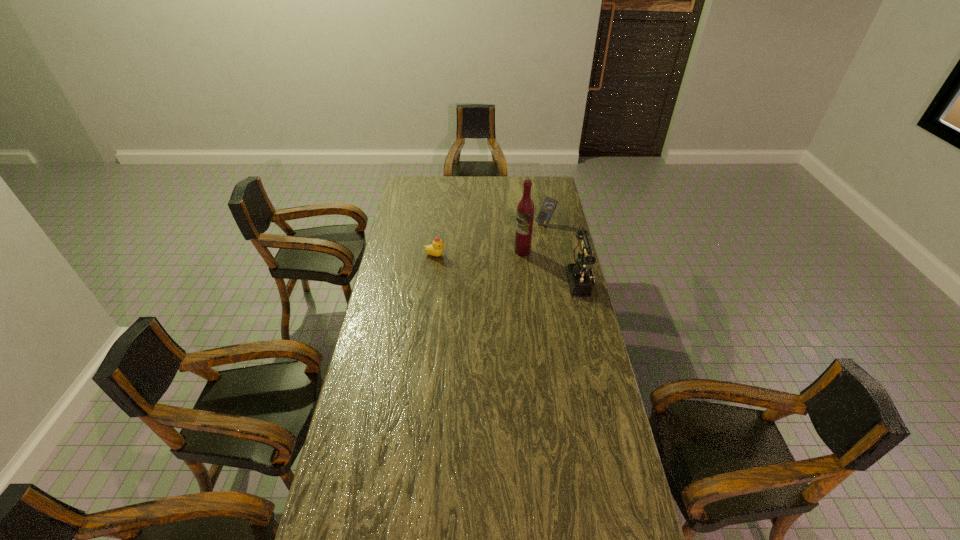
The height and width of the screenshot is (540, 960). Identify the location of vacant space that is in between the tallest object and the leftmost object. (479, 253).

At what (x,y) coordinates should I click in order to perform the action: click on object that is the nearest to the duckling. Please return your answer as a coordinate pair (x, y). The width and height of the screenshot is (960, 540). Looking at the image, I should click on (525, 210).

Point out which object is positioned as the second nearest to the second tallest object. Please provide its 2D coordinates. Your answer should be formatted as a tuple, i.e. [(x, y)], where the tuple contains the x and y coordinates of a point satisfying the conditions above.

[(548, 206)]